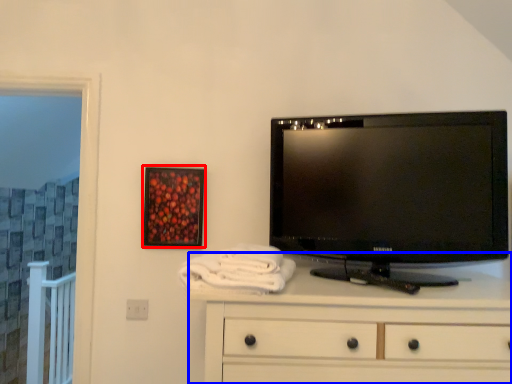
Question: Which of the following is the closest to the observer, picture frame (highlighted by a red box) or chest of drawers (highlighted by a blue box)?

Choices:
 (A) picture frame
 (B) chest of drawers

Answer: (B)